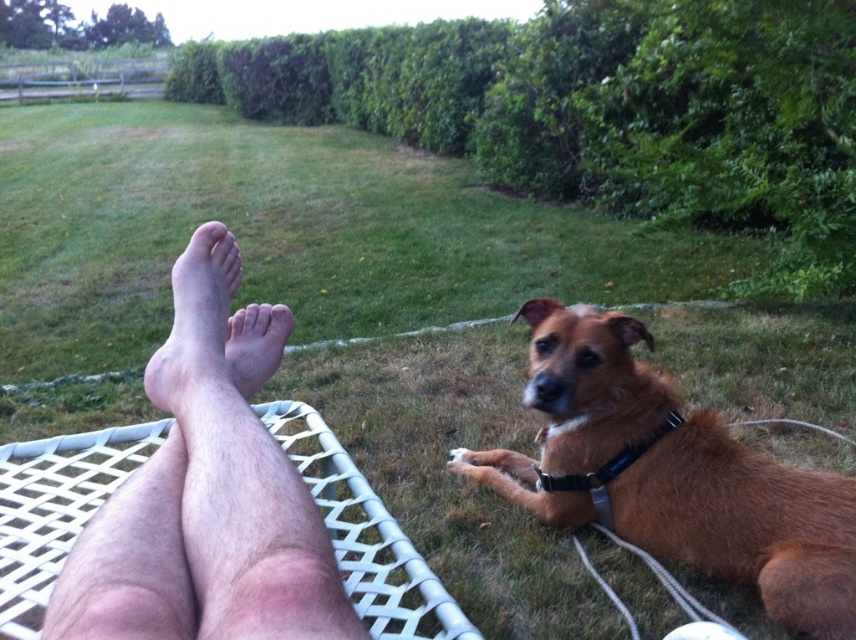
You are a photographer standing at the camera position. You want to take a closeup shot of the brown furry dog at lower right without moving the dog. Can you step forward to get closer? The minimum safe distance to avoid disturbing the dog is 1.5 meters.

The brown furry dog at lower right and camera are 1.55 meters apart from each other. Since the minimum safe distance is 1.5 meters, stepping forward to get closer than 1.55 meters might disturb the dog. Therefore, you should stay at least 1.5 meters away, so you can step forward slightly to 1.5 meters but not closer.

You are standing in the outdoor scene and want to place a small flower pot between the two points, point (214, 595) and point (254, 376). To ensure it is visible from where you are standing, which point should you place it closer to?

To ensure the flower pot is visible from where you are standing, place it closer to point (214, 595) since it is closer to the viewer than point (254, 376).